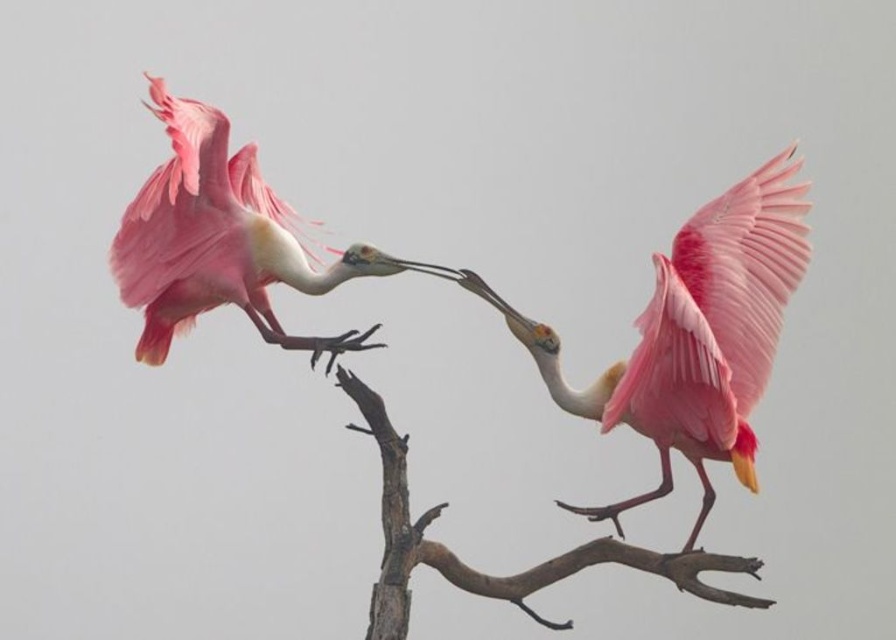
Does point (265, 236) come closer to viewer compared to point (550, 561)?

That is False.

Who is more forward, (240, 211) or (395, 595)?

Point (395, 595) is in front.

Locate an element on the screen. The image size is (896, 640). matte pink spoonbill at upper left is located at coordinates (220, 240).

Is point (751, 477) positioned behind point (177, 212)?

No.

Does point (737, 266) come closer to viewer compared to point (131, 298)?

No, (737, 266) is behind (131, 298).

Does point (755, 250) come closer to viewer compared to point (213, 125)?

No, (755, 250) is further to viewer.

Where is `pink feathered spoonbill at center`? The image size is (896, 640). pink feathered spoonbill at center is located at coordinates (694, 336).

Is point (763, 301) positioned before point (530, 582)?

No, it is not.

Who is taller, pink feathered spoonbill at center or brown rough tree branch at center?

pink feathered spoonbill at center is taller.

Is point (747, 218) farther from viewer compared to point (606, 557)?

Yes.

Locate an element on the screen. The image size is (896, 640). pink feathered spoonbill at center is located at coordinates (694, 336).